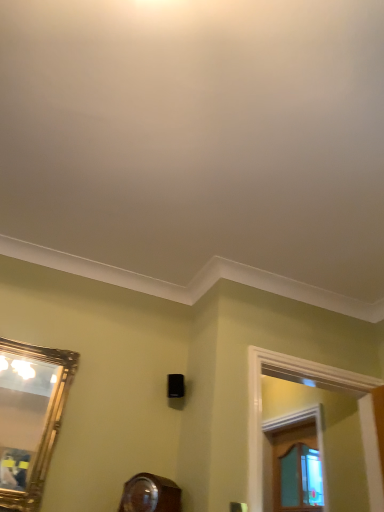
The image size is (384, 512). Describe the element at coordinates (23, 414) in the screenshot. I see `gold-framed mirror at left` at that location.

Looking at this image, measure the distance between wooden window frame at right, which ranks as the first window frame in back-to-front order, and camera.

The distance of wooden window frame at right, which ranks as the first window frame in back-to-front order, from camera is 8.60 feet.

This screenshot has height=512, width=384. Describe the element at coordinates (299, 424) in the screenshot. I see `wooden window frame at right, the 2th window frame viewed from the front` at that location.

Where is `white wood window frame at upper right, placed as the second window frame when sorted from back to front`? Image resolution: width=384 pixels, height=512 pixels. white wood window frame at upper right, placed as the second window frame when sorted from back to front is located at coordinates (261, 404).

At what (x,y) coordinates should I click in order to perform the action: click on gold-framed mirror at left. Please return your answer as a coordinate pair (x, y). The width and height of the screenshot is (384, 512). Looking at the image, I should click on (23, 414).

Can you confirm if gold-framed mirror at left is wider than white wood window frame at upper right, placed as the second window frame when sorted from back to front?

In fact, gold-framed mirror at left might be narrower than white wood window frame at upper right, placed as the second window frame when sorted from back to front.

Is gold-framed mirror at left to the left of white wood window frame at upper right, placed as the second window frame when sorted from back to front, from the viewer's perspective?

Indeed, gold-framed mirror at left is positioned on the left side of white wood window frame at upper right, placed as the second window frame when sorted from back to front.

Who is more distant, gold-framed mirror at left or white wood window frame at upper right, placed as the second window frame when sorted from back to front?

white wood window frame at upper right, placed as the second window frame when sorted from back to front, is further from the camera.

Considering the sizes of objects white wood window frame at upper right, placed as the second window frame when sorted from back to front, and gold-framed mirror at left in the image provided, who is thinner, white wood window frame at upper right, placed as the second window frame when sorted from back to front, or gold-framed mirror at left?

gold-framed mirror at left.

Which of these two, white wood window frame at upper right, placed as the second window frame when sorted from back to front, or gold-framed mirror at left, is bigger?

With larger size is white wood window frame at upper right, placed as the second window frame when sorted from back to front.

Is white wood window frame at upper right, placed as the second window frame when sorted from back to front, outside of gold-framed mirror at left?

Yes, white wood window frame at upper right, placed as the second window frame when sorted from back to front, is outside of gold-framed mirror at left.

How many degrees apart are the facing directions of white wood window frame at upper right, placed as the second window frame when sorted from back to front, and gold-framed mirror at left?

The angle between the facing direction of white wood window frame at upper right, placed as the second window frame when sorted from back to front, and the facing direction of gold-framed mirror at left is 0.0813 degrees.

Is wooden window frame at right, the 2th window frame viewed from the front, smaller than white wood window frame at upper right, the first window frame from the front?

Correct, wooden window frame at right, the 2th window frame viewed from the front, occupies less space than white wood window frame at upper right, the first window frame from the front.

Is the surface of wooden window frame at right, the 2th window frame viewed from the front, in direct contact with white wood window frame at upper right, the first window frame from the front?

No, wooden window frame at right, the 2th window frame viewed from the front, is not making contact with white wood window frame at upper right, the first window frame from the front.

Is point (327, 501) behind point (346, 379)?

Yes, it is behind point (346, 379).

You are a GUI agent. You are given a task and a screenshot of the screen. Output one action in this format:
    pyautogui.click(x=<x>, y=<y>)
    Task: Click on the window frame above the white wood window frame at upper right, placed as the second window frame when sorted from back to front (from a real-world perspective)
    The image size is (384, 512).
    Given the screenshot: What is the action you would take?
    pyautogui.click(x=299, y=424)

At what (x,y) coordinates should I click in order to perform the action: click on window frame positioned vertically above the white wood window frame at upper right, the first window frame from the front (from a real-world perspective). Please return your answer as a coordinate pair (x, y). This screenshot has width=384, height=512. Looking at the image, I should click on (299, 424).

From a real-world perspective, is white wood window frame at upper right, the first window frame from the front, located higher than wooden window frame at right, which ranks as the first window frame in back-to-front order?

No, from a real-world perspective, white wood window frame at upper right, the first window frame from the front, is not above wooden window frame at right, which ranks as the first window frame in back-to-front order.

From the image's perspective, does white wood window frame at upper right, the first window frame from the front, appear higher than wooden window frame at right, the 2th window frame viewed from the front?

Yes, from the image's perspective, white wood window frame at upper right, the first window frame from the front, is above wooden window frame at right, the 2th window frame viewed from the front.

Could you tell me if white wood window frame at upper right, the first window frame from the front, is turned towards wooden window frame at right, which ranks as the first window frame in back-to-front order?

No.

Is gold-framed mirror at left outside of wooden window frame at right, the 2th window frame viewed from the front?

Absolutely, gold-framed mirror at left is external to wooden window frame at right, the 2th window frame viewed from the front.

Between gold-framed mirror at left and wooden window frame at right, the 2th window frame viewed from the front, which one appears on the right side from the viewer's perspective?

Positioned to the right is wooden window frame at right, the 2th window frame viewed from the front.

The image size is (384, 512). What are the coordinates of `mirror below the wooden window frame at right, the 2th window frame viewed from the front (from a real-world perspective)` in the screenshot? It's located at (23, 414).

How much distance is there between gold-framed mirror at left and wooden window frame at right, the 2th window frame viewed from the front?

gold-framed mirror at left and wooden window frame at right, the 2th window frame viewed from the front, are 1.87 meters apart.

Which object is positioned more to the left, wooden window frame at right, which ranks as the first window frame in back-to-front order, or gold-framed mirror at left?

gold-framed mirror at left is more to the left.

How far apart are wooden window frame at right, which ranks as the first window frame in back-to-front order, and gold-framed mirror at left?

They are 1.87 meters apart.

In the image, is wooden window frame at right, which ranks as the first window frame in back-to-front order, positioned in front of or behind gold-framed mirror at left?

wooden window frame at right, which ranks as the first window frame in back-to-front order, is positioned farther from the viewer than gold-framed mirror at left.

Is point (295, 413) less distant than point (22, 463)?

No, (295, 413) is behind (22, 463).

Find the location of a particular element. mirror on the left of the white wood window frame at upper right, the first window frame from the front is located at coordinates (23, 414).

Where is `the 1st window frame counting from the right of the gold-framed mirror at left`? The image size is (384, 512). the 1st window frame counting from the right of the gold-framed mirror at left is located at coordinates (261, 404).

Which object lies further to the anchor point gold-framed mirror at left, wooden window frame at right, which ranks as the first window frame in back-to-front order, or white wood window frame at upper right, the first window frame from the front?

Based on the image, wooden window frame at right, which ranks as the first window frame in back-to-front order, appears to be further to gold-framed mirror at left.

Estimate the real-world distances between objects in this image. Which object is closer to white wood window frame at upper right, the first window frame from the front, gold-framed mirror at left or wooden window frame at right, the 2th window frame viewed from the front?

The object closer to white wood window frame at upper right, the first window frame from the front, is wooden window frame at right, the 2th window frame viewed from the front.

Estimate the real-world distances between objects in this image. Which object is further from white wood window frame at upper right, the first window frame from the front, wooden window frame at right, which ranks as the first window frame in back-to-front order, or gold-framed mirror at left?

Based on the image, gold-framed mirror at left appears to be further to white wood window frame at upper right, the first window frame from the front.

Looking at the image, which one is located closer to wooden window frame at right, the 2th window frame viewed from the front, gold-framed mirror at left or white wood window frame at upper right, the first window frame from the front?

Based on the image, white wood window frame at upper right, the first window frame from the front, appears to be nearer to wooden window frame at right, the 2th window frame viewed from the front.

Which object lies nearer to the anchor point gold-framed mirror at left, white wood window frame at upper right, placed as the second window frame when sorted from back to front, or wooden window frame at right, which ranks as the first window frame in back-to-front order?

white wood window frame at upper right, placed as the second window frame when sorted from back to front.

When comparing their distances from wooden window frame at right, which ranks as the first window frame in back-to-front order, does white wood window frame at upper right, placed as the second window frame when sorted from back to front, or gold-framed mirror at left seem further?

gold-framed mirror at left is further to wooden window frame at right, which ranks as the first window frame in back-to-front order.

Identify the location of window frame between gold-framed mirror at left and wooden window frame at right, which ranks as the first window frame in back-to-front order, in the horizontal direction. (261, 404).